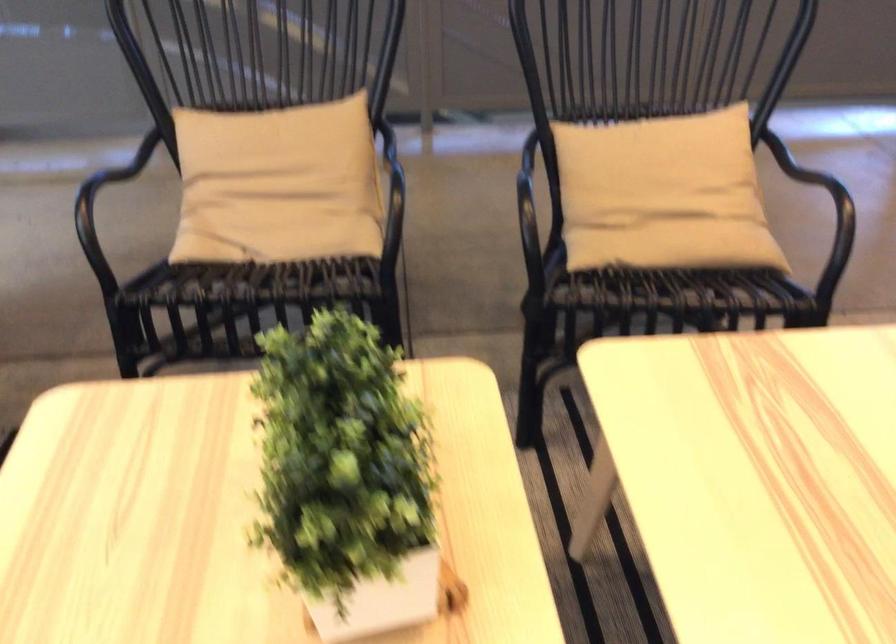
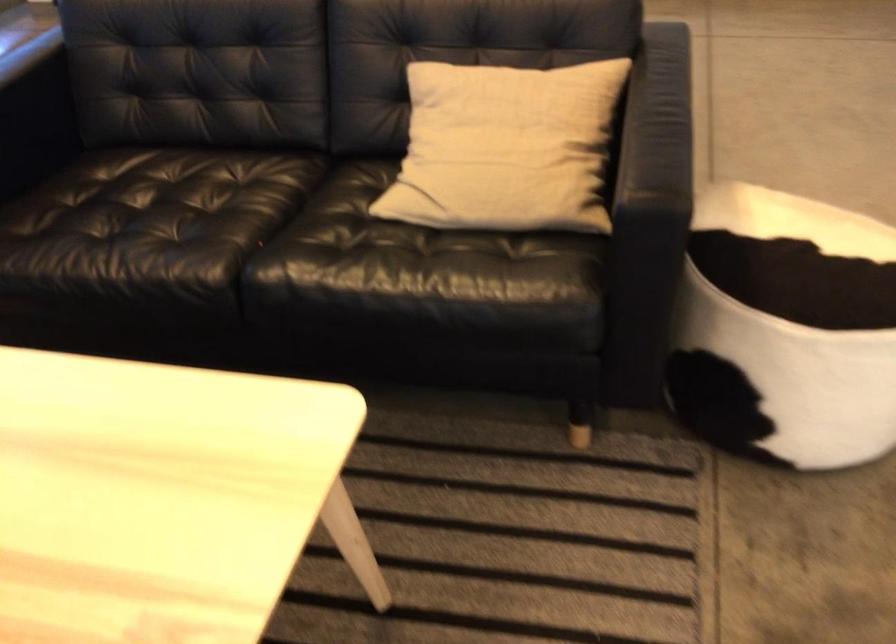
The first image is from the beginning of the video and the second image is from the end. How did the camera likely rotate when shooting the video?

The camera rotated toward right-down.